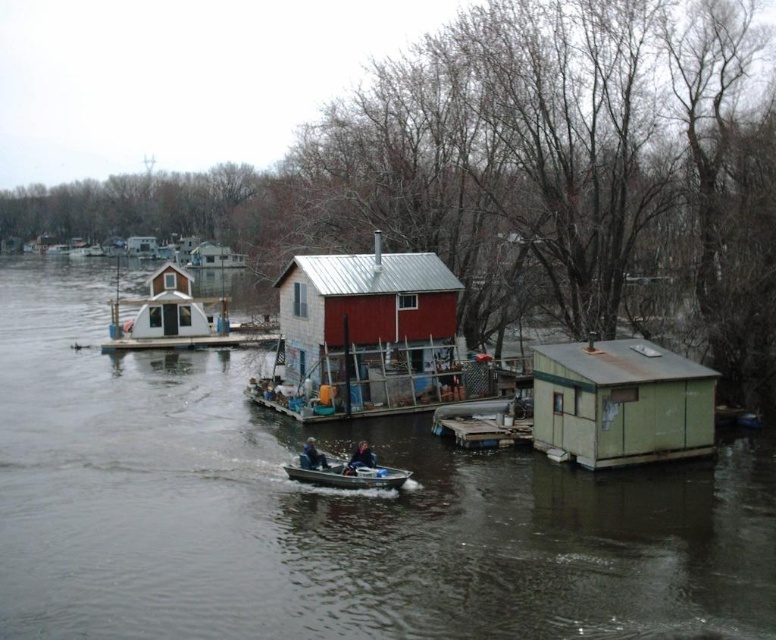
You are standing on the riverside and see the red corrugated metal hut at center and the white plastic hut at upper left. Which one is closer to the water?

The red corrugated metal hut at center is closer to the water because it is positioned below the white plastic hut at upper left.

You are standing at the riverside and want to take a photo of the red corrugated metal hut at center. If your camera has a zoom range up to 30 meters, will you be able to capture the entire hut clearly without moving closer?

The red corrugated metal hut at center is 30.70 meters away from the camera. Since the camera can only zoom up to 30 meters, it cannot capture the entire hut clearly without moving closer.

Consider the image. You are standing at the point marked by coordinates [622,403] in the image. What object are you directly facing?

The point at coordinates [622,403] indicates the green weathered cabin at right, so you are directly facing the green weathered cabin at right.